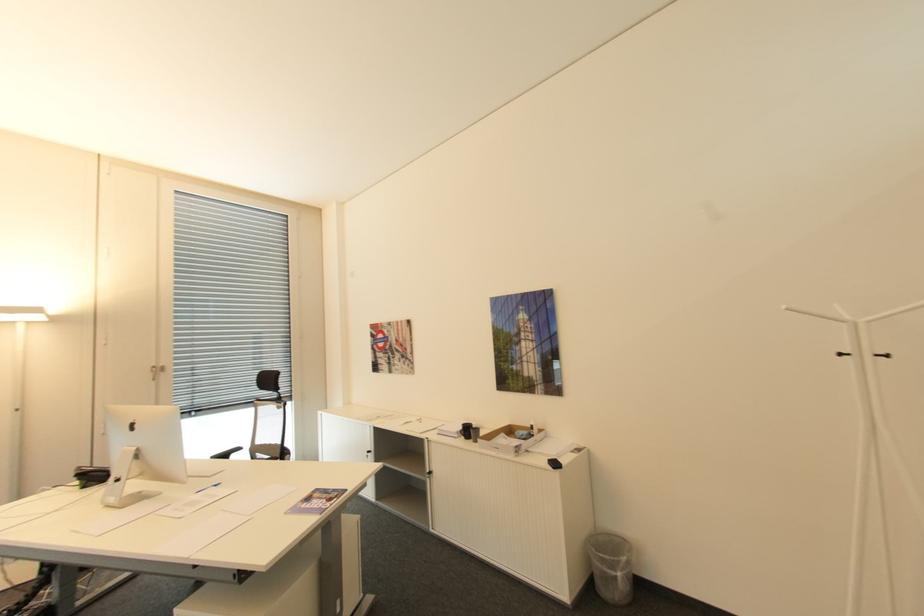
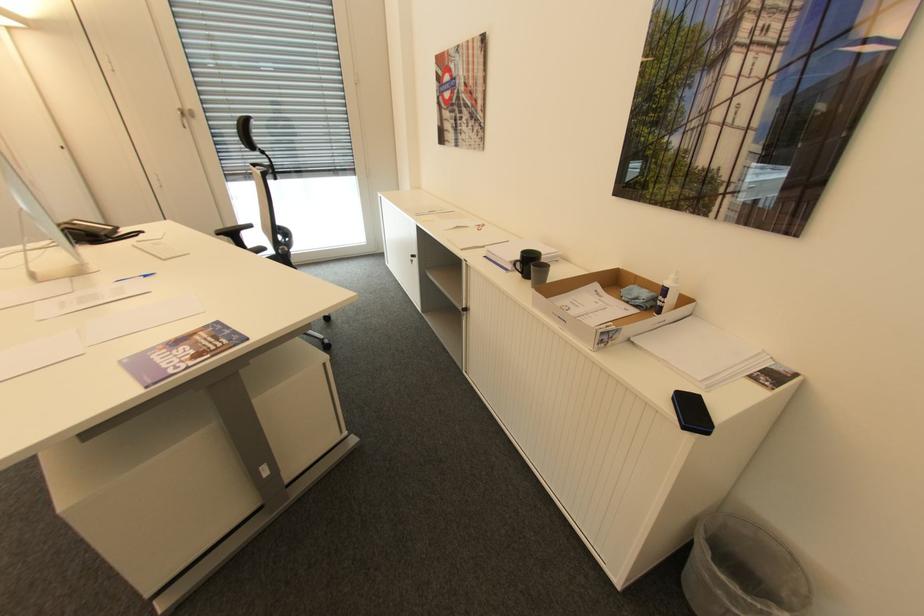
Where in the second image is the point corresponding to point (372, 451) from the first image?

(418, 256)